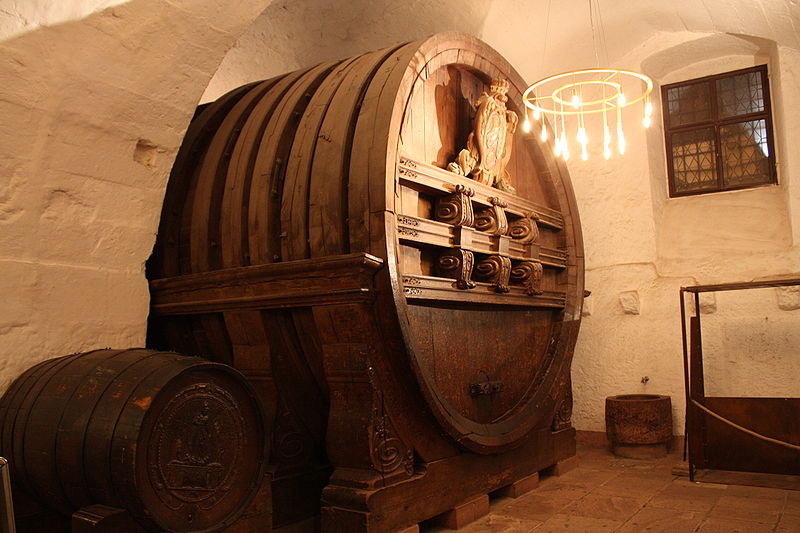
This screenshot has width=800, height=533. Find the location of `faucet`. faucet is located at coordinates (646, 378).